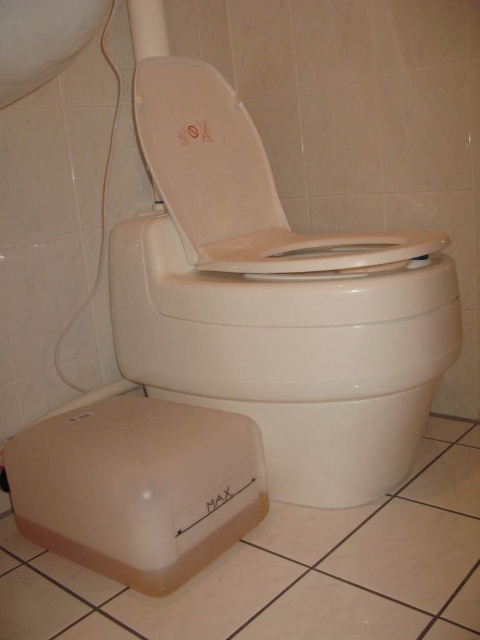
Question: Which of the following is the farthest from the observer?

Choices:
 (A) (398, 298)
 (B) (189, 211)
 (C) (132, 84)

Answer: (C)

Question: Does white plastic toilet bowl at center have a greater width compared to white matte toilet seat at center?

Choices:
 (A) no
 (B) yes

Answer: (B)

Question: Which object is the farthest from the white matte toilet seat at center?

Choices:
 (A) white plastic toilet seat at center
 (B) white plastic toilet bowl at center

Answer: (B)

Question: Is white plastic toilet bowl at center bigger than white plastic toilet seat at center?

Choices:
 (A) no
 (B) yes

Answer: (A)

Question: Does white plastic toilet seat at center appear over white matte toilet seat at center?

Choices:
 (A) no
 (B) yes

Answer: (A)

Question: Which of the following is the closest to the observer?

Choices:
 (A) white plastic toilet seat at center
 (B) white plastic toilet bowl at center
 (C) white matte toilet seat at center

Answer: (B)